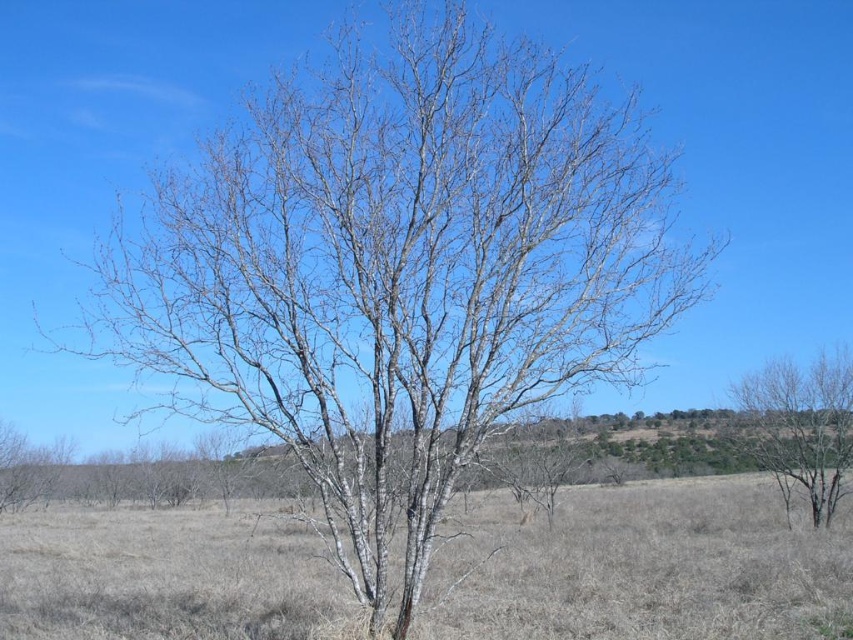
You are a hiker who wants to set up a tent in the open field. You see the dry grass at center and the bare wood tree at right. Which location would be safer to avoid falling branches?

The dry grass at center is positioned under the bare wood tree at right, so setting up the tent there might be risky due to potential falling branches. A safer spot would be away from the area under the tree.

You are standing at the point marked by point (643, 566). Looking around, you see dry grass at center. Which direction should you walk to reach the solitary tree standing prominently in the vast open field?

The point marked by point (643, 566) is located at the dry grass at center. Since the solitary tree is standing prominently in the vast open field, you should walk towards the tree from the dry grass at center. However, the exact direction isn

You are a hiker who wants to set up a tent in the open field. You need to choose between placing it on the dry grass at center or near the bare wood tree at right. Which location offers more space for your tent?

The dry grass at center has a larger size compared to the bare wood tree at right, so placing the tent on the dry grass at center would provide more space.